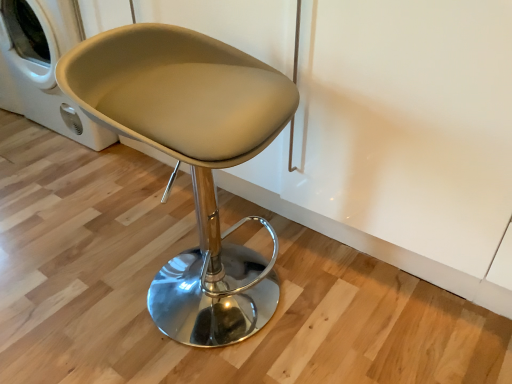
Question: Is white glossy washing machine at left next to beige leather stool at center?

Choices:
 (A) no
 (B) yes

Answer: (A)

Question: Is white glossy washing machine at left shorter than beige leather stool at center?

Choices:
 (A) no
 (B) yes

Answer: (B)

Question: Is white glossy washing machine at left not close to beige leather stool at center?

Choices:
 (A) yes
 (B) no

Answer: (B)

Question: Is white glossy washing machine at left positioned beyond the bounds of beige leather stool at center?

Choices:
 (A) yes
 (B) no

Answer: (A)

Question: Is white glossy washing machine at left in front of beige leather stool at center?

Choices:
 (A) no
 (B) yes

Answer: (A)

Question: Does white glossy washing machine at left have a lesser width compared to beige leather stool at center?

Choices:
 (A) no
 (B) yes

Answer: (A)

Question: Considering the relative sizes of beige leather stool at center and white glossy washing machine at left in the image provided, is beige leather stool at center smaller than white glossy washing machine at left?

Choices:
 (A) yes
 (B) no

Answer: (A)

Question: From a real-world perspective, is beige leather stool at center on white glossy washing machine at left?

Choices:
 (A) no
 (B) yes

Answer: (B)

Question: From the image's perspective, is beige leather stool at center located above white glossy washing machine at left?

Choices:
 (A) no
 (B) yes

Answer: (A)

Question: Can you confirm if beige leather stool at center is shorter than white glossy washing machine at left?

Choices:
 (A) no
 (B) yes

Answer: (A)

Question: Is beige leather stool at center positioned with its back to white glossy washing machine at left?

Choices:
 (A) yes
 (B) no

Answer: (B)

Question: From the image's perspective, is beige leather stool at center located beneath white glossy washing machine at left?

Choices:
 (A) no
 (B) yes

Answer: (B)

Question: Considering the positions of white glossy washing machine at left and beige leather stool at center in the image, is white glossy washing machine at left taller or shorter than beige leather stool at center?

Choices:
 (A) short
 (B) tall

Answer: (A)